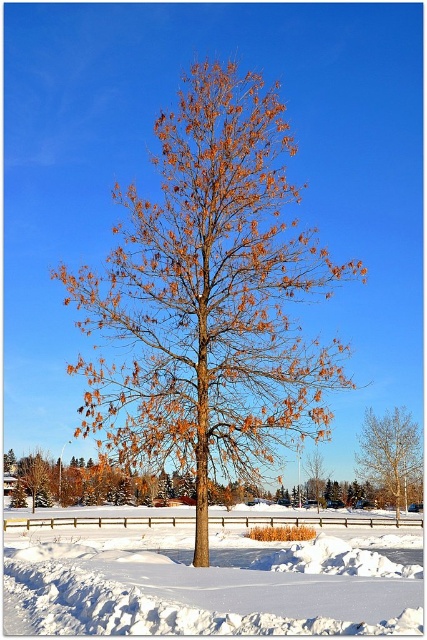
You are planning to build a snowman using the white fluffy snow at center near the brown matte tree at center. Since the snowman needs to be in front of the tree for visibility, is the snow available in the right location?

The white fluffy snow at center is behind the brown matte tree at center, so the snow is not in front of the tree. Therefore, you cannot build the snowman in front of the tree using the available snow at that location.